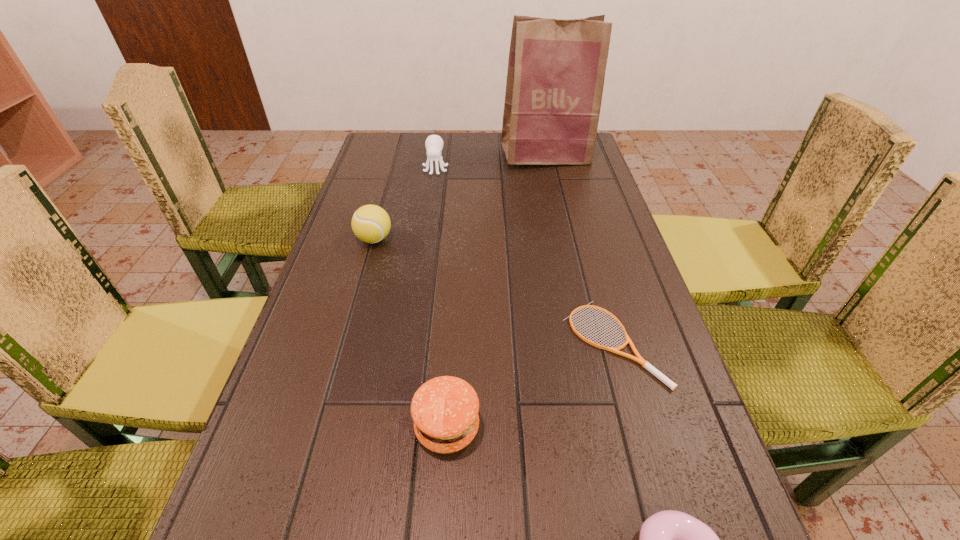
The image size is (960, 540). Find the location of `the tallest object`. the tallest object is located at coordinates (556, 68).

Where is `octopus`? The image size is (960, 540). octopus is located at coordinates (434, 143).

Where is `the leftmost object`? The image size is (960, 540). the leftmost object is located at coordinates (370, 223).

The image size is (960, 540). Find the location of `tennis ball`. tennis ball is located at coordinates (370, 223).

In order to click on patty in this screenshot , I will do `click(445, 409)`.

You are a GUI agent. You are given a task and a screenshot of the screen. Output one action in this format:
    pyautogui.click(x=<x>, y=<y>)
    Task: Click on the third nearest object
    
    Given the screenshot: What is the action you would take?
    pyautogui.click(x=638, y=358)

Locate an element on the screen. tennis racket is located at coordinates (638, 358).

You are a GUI agent. You are given a task and a screenshot of the screen. Output one action in this format:
    pyautogui.click(x=<x>, y=<y>)
    Task: Click on the free spot located on the front-facing side of the grocery bag
    This screenshot has height=540, width=960.
    Given the screenshot: What is the action you would take?
    pyautogui.click(x=551, y=179)

This screenshot has width=960, height=540. What are the coordinates of `free space located on the front-facing side of the octopus` in the screenshot? It's located at (430, 207).

This screenshot has width=960, height=540. What are the coordinates of `vacant point located 0.260m on the front of the leftmost object` in the screenshot? It's located at (348, 331).